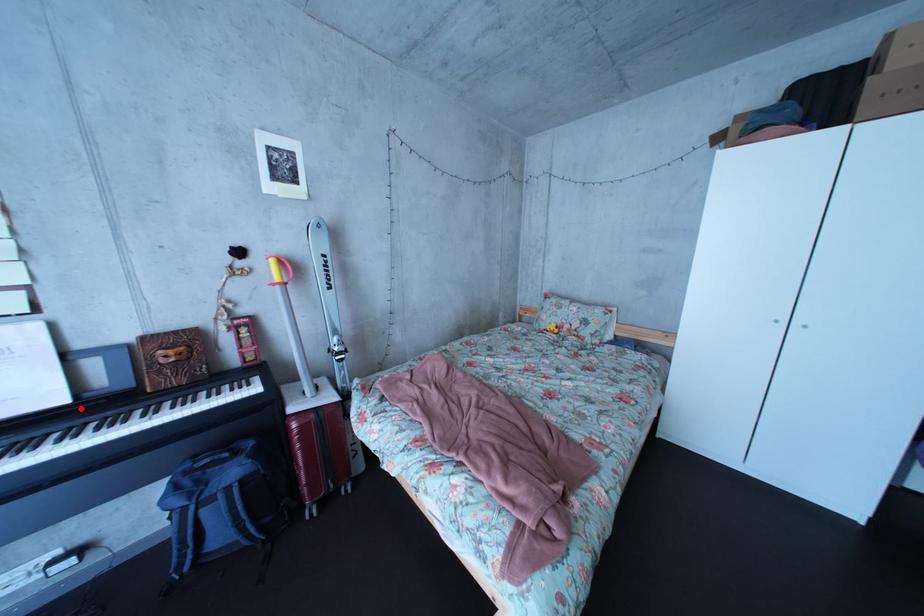
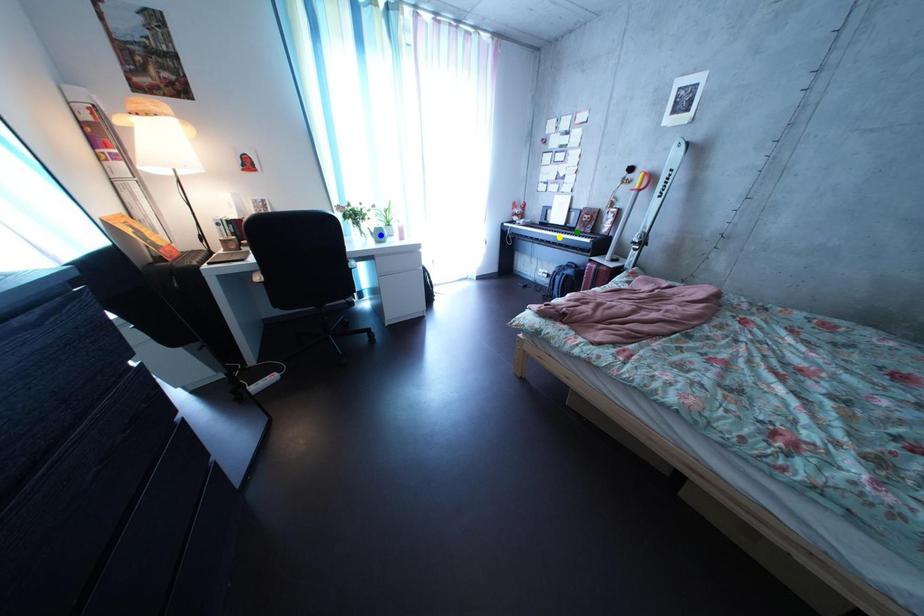
Question: I am providing you with two images of the same scene from different viewpoints. A red point is marked on the first image. You are given multiple points on the second image. Can you choose the point in image 2 that corresponds to the point in image 1?

Choices:
 (A) yellow point
 (B) green point
 (C) blue point

Answer: (B)